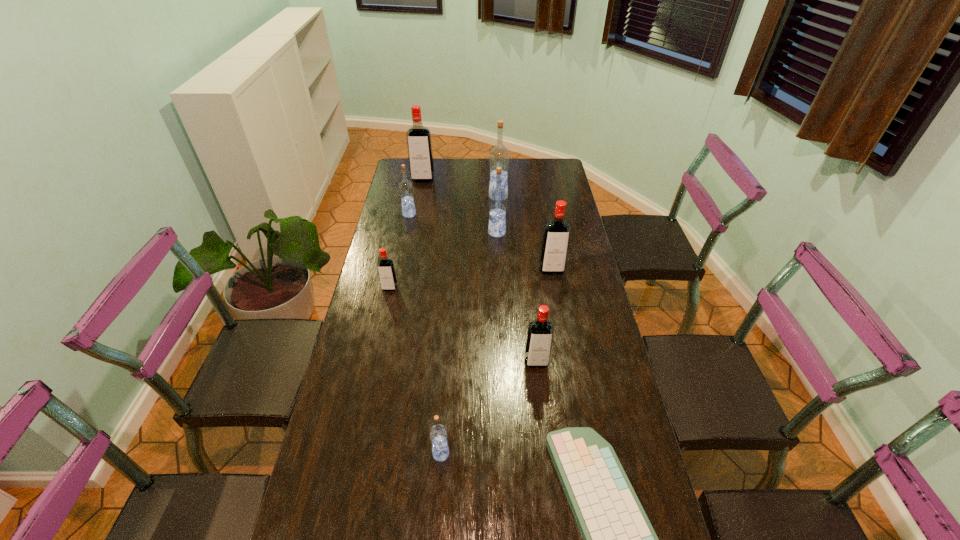
What are the coordinates of `the biggest red vodka` in the screenshot? It's located at (419, 144).

Where is `the farthest vodka`? the farthest vodka is located at coordinates (419, 144).

In order to click on the biggest blue vodka in this screenshot , I will do `click(499, 156)`.

Find the location of `the second farthest object`. the second farthest object is located at coordinates (499, 156).

The image size is (960, 540). I want to click on the fifth farthest vodka, so click(x=556, y=236).

Where is `the rightmost red vodka`? The height and width of the screenshot is (540, 960). the rightmost red vodka is located at coordinates (556, 236).

Image resolution: width=960 pixels, height=540 pixels. I want to click on the third farthest blue vodka, so click(498, 197).

Locate an element on the screen. The image size is (960, 540). the fourth farthest vodka is located at coordinates (498, 197).

Locate an element on the screen. the leftmost blue vodka is located at coordinates (405, 187).

Locate an element on the screen. This screenshot has height=540, width=960. the third biggest blue vodka is located at coordinates (405, 187).